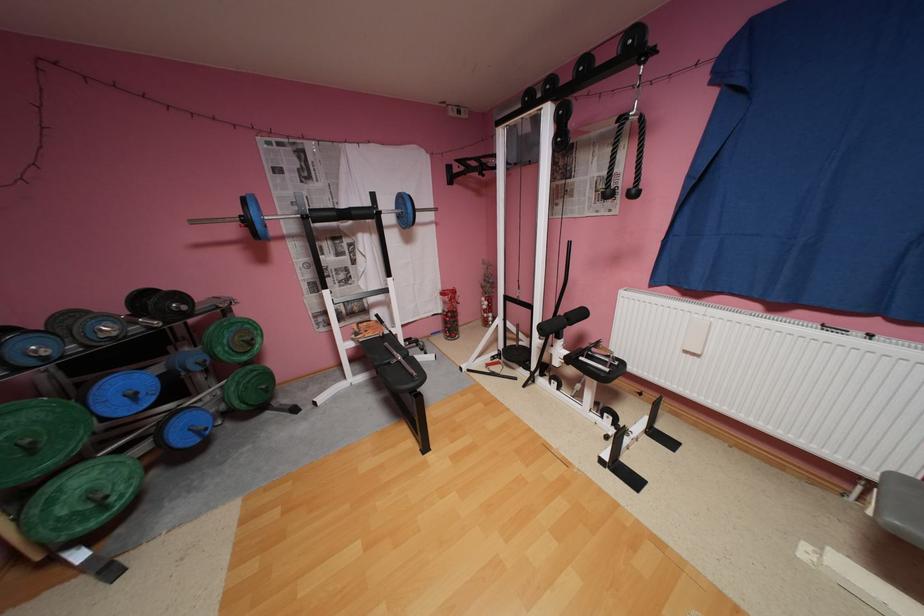
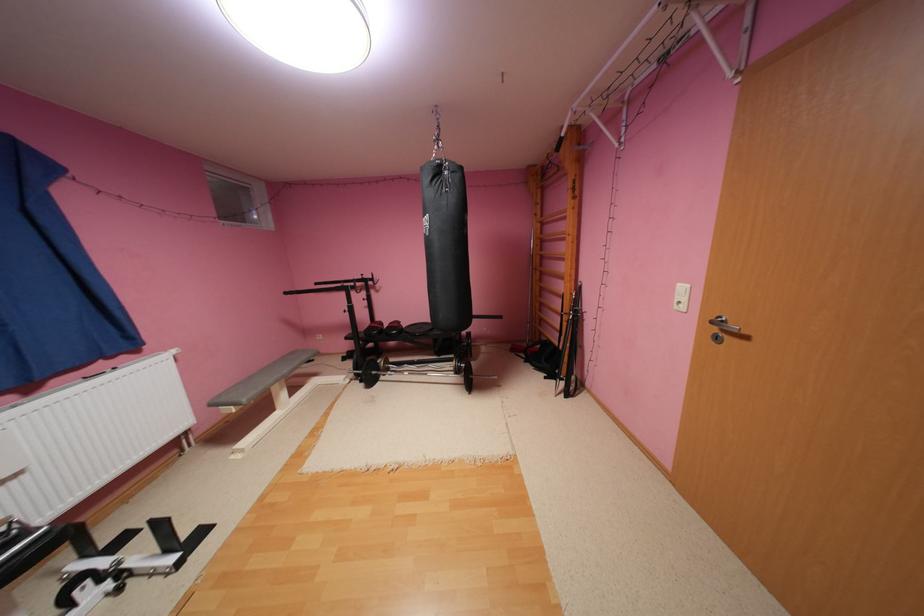
The point at (x=695, y=352) is marked in the first image. Where is the corresponding point in the second image?

(11, 483)